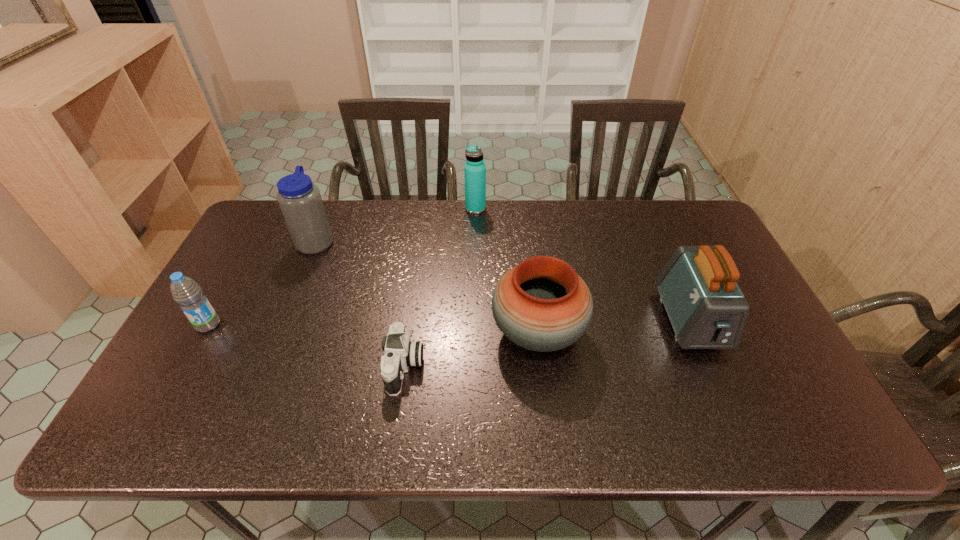
Locate an element on the screen. The width and height of the screenshot is (960, 540). free space between the nearest water bottle and the farthest water bottle is located at coordinates (342, 267).

Identify which object is the third closest to the camera. Please provide its 2D coordinates. Your answer should be formatted as a tuple, i.e. [(x, y)], where the tuple contains the x and y coordinates of a point satisfying the conditions above.

[(186, 292)]

What are the coordinates of `object that ranks as the closest to the toaster` in the screenshot? It's located at (542, 304).

Locate which water bottle ranks in proximity to the fourth object from left to right. Please provide its 2D coordinates. Your answer should be formatted as a tuple, i.e. [(x, y)], where the tuple contains the x and y coordinates of a point satisfying the conditions above.

[(300, 201)]

Locate which water bottle is the second closest to the fourth object from right to left. Please provide its 2D coordinates. Your answer should be formatted as a tuple, i.e. [(x, y)], where the tuple contains the x and y coordinates of a point satisfying the conditions above.

[(186, 292)]

This screenshot has height=540, width=960. What are the coordinates of `vacant area that satisfies the following two spatial constraints: 1. with a carrying loop on the side of the camera; 2. on the left side of the second farthest water bottle` in the screenshot? It's located at (264, 367).

The height and width of the screenshot is (540, 960). Find the location of `free space that satisfies the following two spatial constraints: 1. on the back side of the camera; 2. with a carrying loop on the side of the second object from left to right`. free space that satisfies the following two spatial constraints: 1. on the back side of the camera; 2. with a carrying loop on the side of the second object from left to right is located at coordinates (422, 240).

Identify the location of free spot that satisfies the following two spatial constraints: 1. with a carrying loop on the side of the second farthest object; 2. on the right side of the second object from right to left. (278, 332).